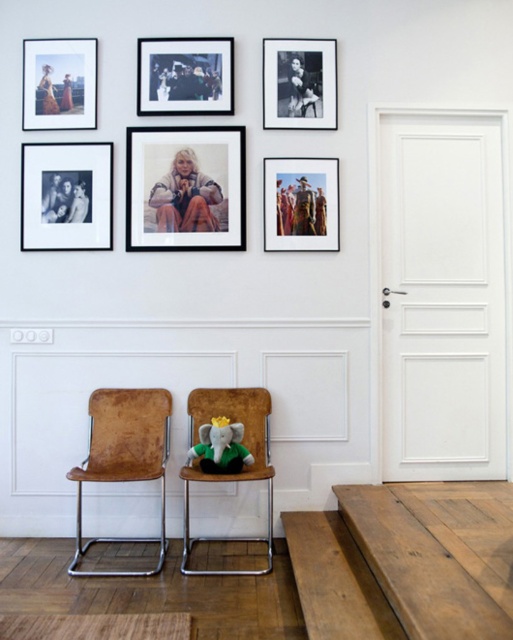
Question: Can you confirm if matte black photo frame at center is positioned to the left of green plush elephant at center?

Choices:
 (A) no
 (B) yes

Answer: (B)

Question: Which of the following is the closest to the observer?

Choices:
 (A) matte black photo frame at center
 (B) black matte photo frame at upper center

Answer: (A)

Question: Among these points, which one is nearest to the camera?

Choices:
 (A) (184, 180)
 (B) (289, 97)

Answer: (A)

Question: Considering the relative positions of black matte picture frame at upper left and matte paper photo at center in the image provided, where is black matte picture frame at upper left located with respect to matte paper photo at center?

Choices:
 (A) left
 (B) right

Answer: (A)

Question: Does matte black photo frame at center have a smaller size compared to black matte photo frame at upper center?

Choices:
 (A) no
 (B) yes

Answer: (A)

Question: Among these points, which one is farthest from the camera?

Choices:
 (A) (140, 52)
 (B) (191, 456)
 (C) (137, 227)
 (D) (232, 406)

Answer: (A)